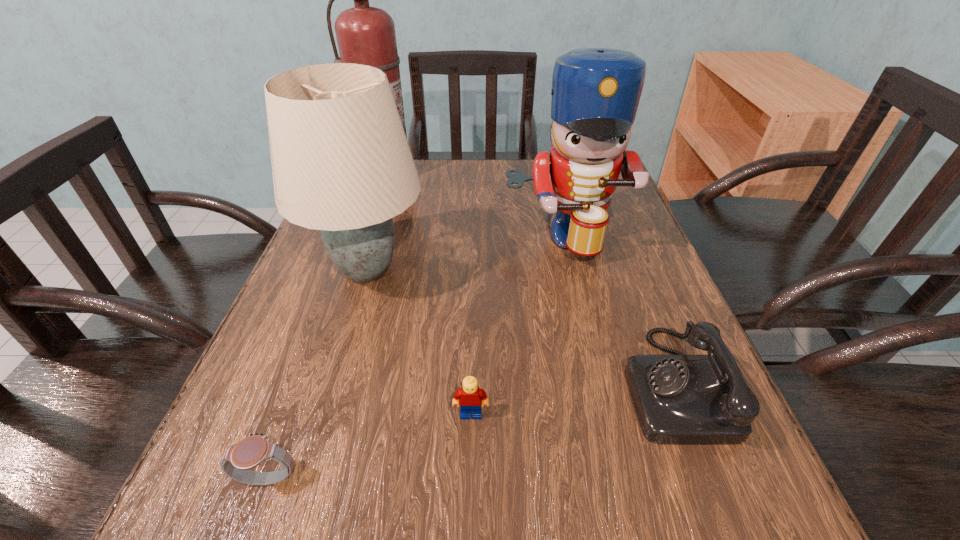
The width and height of the screenshot is (960, 540). In order to click on vacant space that's between the third object from right to left and the lampshade in this screenshot , I will do `click(419, 342)`.

The image size is (960, 540). Find the location of `free space between the Lego and the fourth tallest object`. free space between the Lego and the fourth tallest object is located at coordinates (572, 399).

The height and width of the screenshot is (540, 960). I want to click on vacant space that's between the third shortest object and the nutcracker, so click(619, 310).

The image size is (960, 540). In order to click on free space between the watch and the telephone in this screenshot , I will do [x=471, y=431].

Find the location of a particular element. free space between the lampshade and the watch is located at coordinates (318, 374).

This screenshot has height=540, width=960. I want to click on free space that is in between the nutcracker and the lampshade, so click(x=466, y=253).

The image size is (960, 540). I want to click on vacant space in between the nutcracker and the third object from right to left, so click(x=517, y=325).

Locate which object ranks fourth in proximity to the fire extinguisher. Please provide its 2D coordinates. Your answer should be formatted as a tuple, i.e. [(x, y)], where the tuple contains the x and y coordinates of a point satisfying the conditions above.

[(471, 397)]

Identify the location of object that is the closest one to the nutcracker. (341, 163).

The image size is (960, 540). I want to click on vacant space that satisfies the following two spatial constraints: 1. on the dial of the telephone; 2. on the front side of the watch, so click(x=710, y=478).